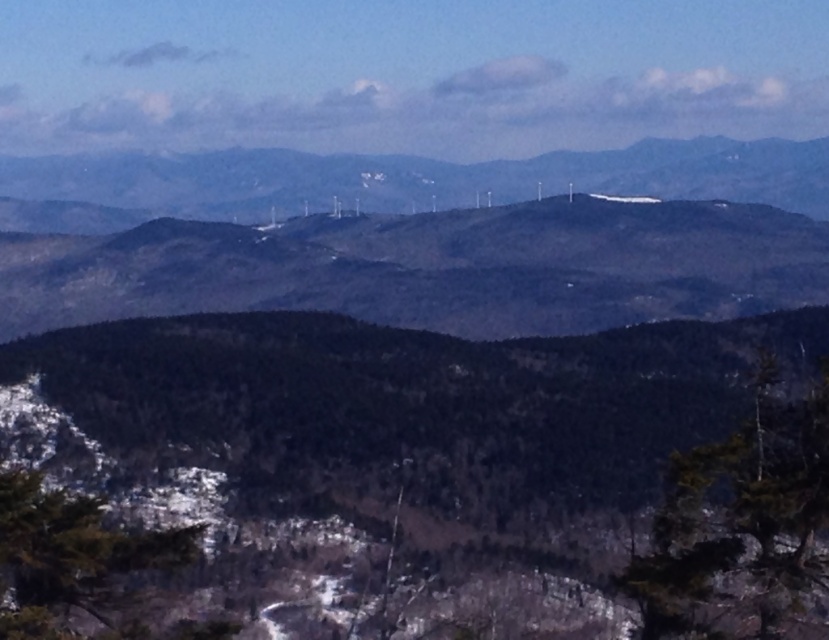
You are standing at the point marked by the coordinates point [389,451] in the image. Based on the scene description, what is the nearest object to you?

The point [389,451] indicates green matte tree at center, so the nearest object to you is the green matte tree at center.

You are standing at the origin point in the image, which is the bottom left corner. You want to locate the green matte tree at center. In which direction should you look relative to your current position?

The green matte tree at center is located at coordinates approximately 0.706 on the x axis and 0.470 on the y axis. Since the origin is the bottom left corner, this means the tree is to the right and slightly above your current position.

You are an environmental scientist assessing the forest composition. You observe the green matte tree at center and the green textured tree at lower right. Which tree would you estimate to have a greater canopy spread based on their visual characteristics?

The green matte tree at center is larger in size than the green textured tree at lower right, so it likely has a greater canopy spread.